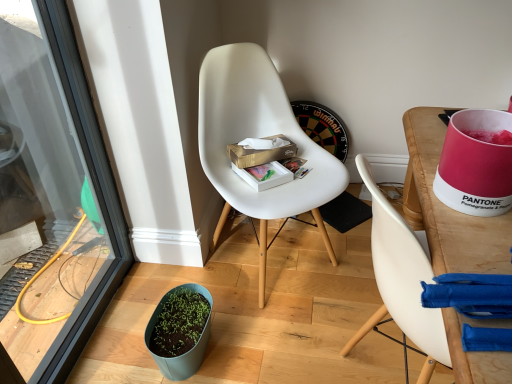
Question: Is wooden desk at right to the right of gold cardboard tissue box at center, the second box from the bottom, from the viewer's perspective?

Choices:
 (A) no
 (B) yes

Answer: (B)

Question: Considering the relative sizes of wooden desk at right and gold cardboard tissue box at center, the second box from the bottom, in the image provided, is wooden desk at right smaller than gold cardboard tissue box at center, the second box from the bottom,?

Choices:
 (A) yes
 (B) no

Answer: (B)

Question: Considering the relative positions of wooden desk at right and gold cardboard tissue box at center, the second box from the bottom, in the image provided, is wooden desk at right to the left of gold cardboard tissue box at center, the second box from the bottom, from the viewer's perspective?

Choices:
 (A) no
 (B) yes

Answer: (A)

Question: Is wooden desk at right positioned beyond the bounds of gold cardboard tissue box at center, the second box from the bottom?

Choices:
 (A) no
 (B) yes

Answer: (B)

Question: Considering the relative sizes of wooden desk at right and gold cardboard tissue box at center, the first box viewed from the top, in the image provided, is wooden desk at right taller than gold cardboard tissue box at center, the first box viewed from the top,?

Choices:
 (A) yes
 (B) no

Answer: (A)

Question: Is wooden desk at right bigger than gold cardboard tissue box at center, the first box viewed from the top?

Choices:
 (A) no
 (B) yes

Answer: (B)

Question: Is gold cardboard tissue box at center, the second box from the bottom, positioned before green matte flowerpot at lower left?

Choices:
 (A) yes
 (B) no

Answer: (B)

Question: Considering the relative sizes of gold cardboard tissue box at center, the second box from the bottom, and green matte flowerpot at lower left in the image provided, is gold cardboard tissue box at center, the second box from the bottom, bigger than green matte flowerpot at lower left?

Choices:
 (A) no
 (B) yes

Answer: (A)

Question: Does gold cardboard tissue box at center, the second box from the bottom, have a lesser height compared to green matte flowerpot at lower left?

Choices:
 (A) yes
 (B) no

Answer: (A)

Question: Considering the relative sizes of gold cardboard tissue box at center, the second box from the bottom, and green matte flowerpot at lower left in the image provided, is gold cardboard tissue box at center, the second box from the bottom, thinner than green matte flowerpot at lower left?

Choices:
 (A) no
 (B) yes

Answer: (B)

Question: Does gold cardboard tissue box at center, the second box from the bottom, turn towards green matte flowerpot at lower left?

Choices:
 (A) yes
 (B) no

Answer: (B)

Question: Would you consider gold cardboard tissue box at center, the first box viewed from the top, to be distant from green matte flowerpot at lower left?

Choices:
 (A) yes
 (B) no

Answer: (B)

Question: Can you confirm if green matte flowerpot at lower left is wider than wooden desk at right?

Choices:
 (A) yes
 (B) no

Answer: (B)